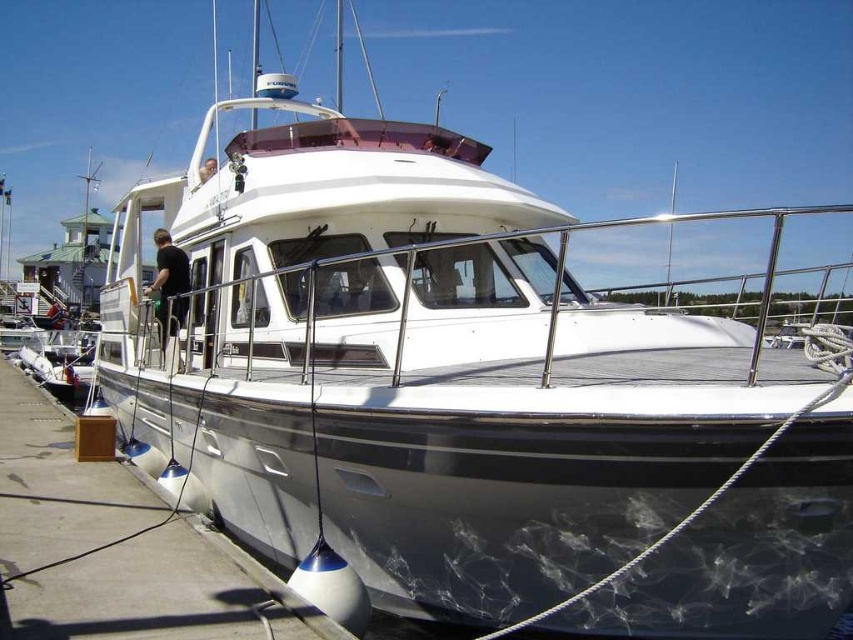
Which of these two, white glossy dock at lower center or light brown wooden boat at center, stands shorter?

Standing shorter between the two is white glossy dock at lower center.

Who is lower down, white glossy dock at lower center or light brown wooden boat at center?

white glossy dock at lower center

Is point (48, 632) positioned in front of point (206, 172)?

Yes, it is in front of point (206, 172).

Find the location of `white glossy dock at lower center`. white glossy dock at lower center is located at coordinates (165, 593).

Is white glossy dock at lower center bigger than black matte shirt at center?

Yes.

Measure the distance between white glossy dock at lower center and black matte shirt at center.

white glossy dock at lower center and black matte shirt at center are 2.19 meters apart.

Is point (119, 468) less distant than point (173, 252)?

Yes, it is.

In order to click on white glossy dock at lower center in this screenshot , I will do `click(165, 593)`.

Is black matte shirt at center wider than light brown wooden boat at center?

Yes, black matte shirt at center is wider than light brown wooden boat at center.

Who is lower down, black matte shirt at center or light brown wooden boat at center?

black matte shirt at center is lower down.

Consider the image. Who is more distant from viewer, (183, 280) or (202, 177)?

Point (202, 177)

This screenshot has height=640, width=853. What are the coordinates of `black matte shirt at center` in the screenshot? It's located at (169, 285).